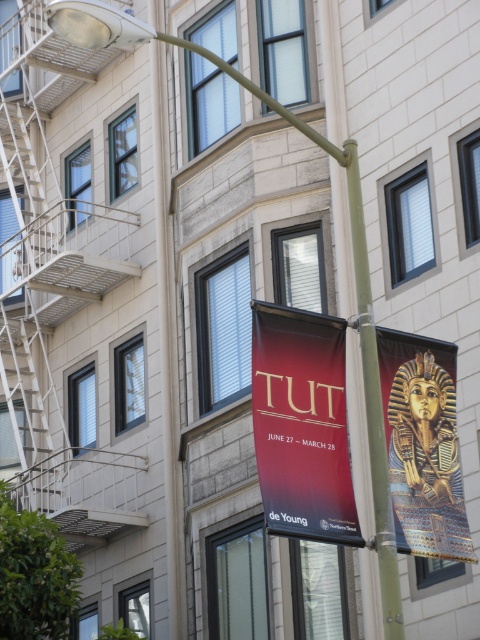
Is matte gold banner at center further to the viewer compared to gold metallic pharaoh mask at right?

No, matte gold banner at center is closer to the viewer.

Identify the location of matte gold banner at center. (301, 424).

Find the location of a particular element. matte gold banner at center is located at coordinates (301, 424).